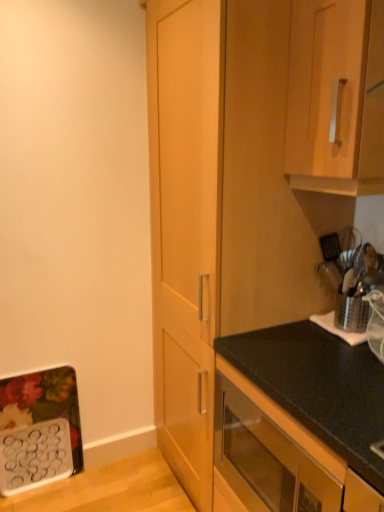
Question: Should I look upward or downward to see wooden cabinet at center, the second cabinetry viewed from the top?

Choices:
 (A) up
 (B) down

Answer: (B)

Question: Considering the relative sizes of black matte oven at lower center, the first cabinetry ordered from the bottom, and wooden cabinet at center, the second cabinetry viewed from the top, in the image provided, is black matte oven at lower center, the first cabinetry ordered from the bottom, wider than wooden cabinet at center, the second cabinetry viewed from the top,?

Choices:
 (A) yes
 (B) no

Answer: (B)

Question: Is wooden cabinet at center, the second cabinetry viewed from the top, at the back of black matte oven at lower center, which is counted as the 3th cabinetry, starting from the top?

Choices:
 (A) no
 (B) yes

Answer: (A)

Question: Is black matte oven at lower center, which is counted as the 3th cabinetry, starting from the top, aimed at wooden cabinet at center, the second cabinetry viewed from the top?

Choices:
 (A) yes
 (B) no

Answer: (B)

Question: Is black matte oven at lower center, which is counted as the 3th cabinetry, starting from the top, smaller than wooden cabinet at center, the second cabinetry viewed from the top?

Choices:
 (A) no
 (B) yes

Answer: (B)

Question: Is black matte oven at lower center, the first cabinetry ordered from the bottom, positioned before wooden cabinet at center, the second cabinetry viewed from the top?

Choices:
 (A) no
 (B) yes

Answer: (B)

Question: Are black matte oven at lower center, the first cabinetry ordered from the bottom, and wooden cabinet at center, the second cabinetry viewed from the top, located far from each other?

Choices:
 (A) no
 (B) yes

Answer: (A)

Question: Is the surface of wooden cabinet handle at upper right, which appears as the 1th cabinetry when viewed from the top, in direct contact with wooden cabinet at center, the second cabinetry viewed from the top?

Choices:
 (A) no
 (B) yes

Answer: (A)

Question: Is wooden cabinet handle at upper right, which appears as the 1th cabinetry when viewed from the top, oriented towards wooden cabinet at center, acting as the second cabinetry starting from the bottom?

Choices:
 (A) yes
 (B) no

Answer: (B)

Question: Considering the relative sizes of wooden cabinet handle at upper right, the third cabinetry when ordered from bottom to top, and wooden cabinet at center, the second cabinetry viewed from the top, in the image provided, is wooden cabinet handle at upper right, the third cabinetry when ordered from bottom to top, thinner than wooden cabinet at center, the second cabinetry viewed from the top,?

Choices:
 (A) no
 (B) yes

Answer: (B)

Question: Does wooden cabinet handle at upper right, which appears as the 1th cabinetry when viewed from the top, have a smaller size compared to wooden cabinet at center, the second cabinetry viewed from the top?

Choices:
 (A) yes
 (B) no

Answer: (A)

Question: Is wooden cabinet handle at upper right, the third cabinetry when ordered from bottom to top, shorter than wooden cabinet at center, acting as the second cabinetry starting from the bottom?

Choices:
 (A) no
 (B) yes

Answer: (B)

Question: Is wooden cabinet handle at upper right, the third cabinetry when ordered from bottom to top, closer to the viewer compared to wooden cabinet at center, acting as the second cabinetry starting from the bottom?

Choices:
 (A) yes
 (B) no

Answer: (A)

Question: Considering the relative sizes of black matte oven at lower center, which is counted as the 3th cabinetry, starting from the top, and wooden cabinet handle at upper right, which appears as the 1th cabinetry when viewed from the top, in the image provided, is black matte oven at lower center, which is counted as the 3th cabinetry, starting from the top, taller than wooden cabinet handle at upper right, which appears as the 1th cabinetry when viewed from the top,?

Choices:
 (A) yes
 (B) no

Answer: (B)